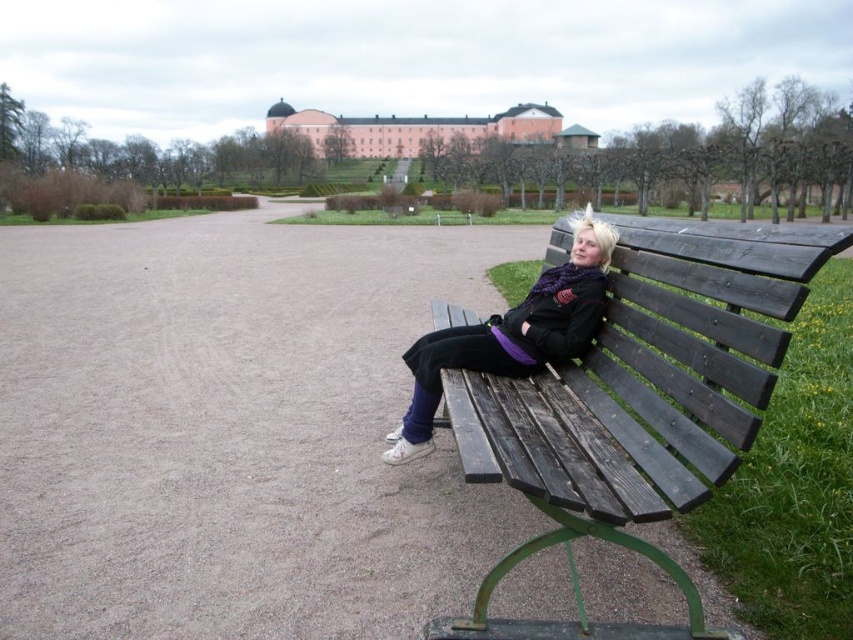
You are standing at the entrance of the park and see the brown wooden bench at right and the matte black jacket at center. Which object is positioned to the left when viewed from your perspective?

The brown wooden bench at right is to the left of the matte black jacket at center from your perspective.

Based on the photo, you are a park visitor who wants to sit down. You see the dark wood bench at right and the brown wooden bench at right. Which one is closer to you?

The dark wood bench at right is closer to you since it is 3.74 meters away from the brown wooden bench at right, meaning the dark wood bench is nearer than the brown wooden bench.

You are planning to place a rectangular box on the brown wooden bench at right. The box is as wide as the matte black jacket at center. Will the box fit entirely on the bench?

The brown wooden bench at right is wider than the matte black jacket at center. Since the box has the same width as the jacket, it will fit entirely on the bench.